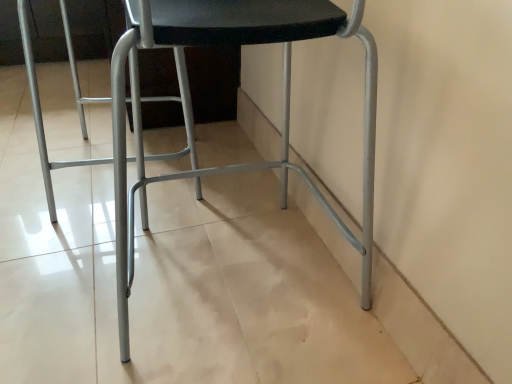
Find the location of a particular element. The width and height of the screenshot is (512, 384). unoccupied area in front of metallic silver swivel chair at center is located at coordinates (68, 259).